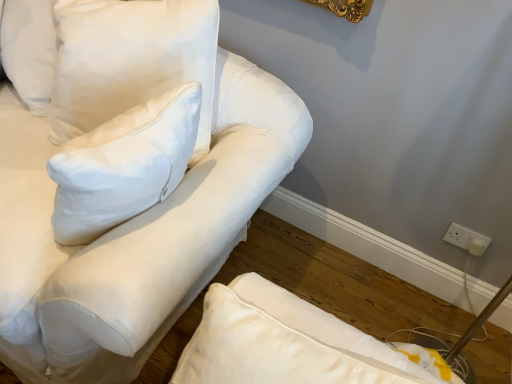
This screenshot has height=384, width=512. What are the coordinates of `white plastic socket at lower right` in the screenshot? It's located at (467, 239).

What is the approximate height of white cotton sofa at upper left?

The height of white cotton sofa at upper left is 32.60 inches.

This screenshot has width=512, height=384. I want to click on white plastic socket at lower right, so click(467, 239).

Would you say white plastic socket at lower right is to the left or to the right of white cotton sofa at upper left in the picture?

Based on their positions, white plastic socket at lower right is located to the right of white cotton sofa at upper left.

Is white plastic socket at lower right not close to white cotton sofa at upper left?

Yes, white plastic socket at lower right and white cotton sofa at upper left are located far from each other.

From the image's perspective, is white plastic socket at lower right located above or below white cotton sofa at upper left?

white plastic socket at lower right is situated lower than white cotton sofa at upper left in the image.

Is white cotton pillow at upper left, the first pillow positioned from the right, situated inside white plastic socket at lower right or outside?

white cotton pillow at upper left, the first pillow positioned from the right, is outside white plastic socket at lower right.

Based on the photo, can you confirm if white cotton pillow at upper left, the first pillow positioned from the right, is positioned to the left of white plastic socket at lower right?

Indeed, white cotton pillow at upper left, the first pillow positioned from the right, is positioned on the left side of white plastic socket at lower right.

From a real-world perspective, between white cotton pillow at upper left, the first pillow positioned from the right, and white plastic socket at lower right, who is vertically lower?

white plastic socket at lower right is physically lower.

Considering the sizes of objects white cotton pillow at upper left, the first pillow when ordered from left to right, and white plastic socket at lower right in the image provided, who is smaller, white cotton pillow at upper left, the first pillow when ordered from left to right, or white plastic socket at lower right?

white plastic socket at lower right is smaller.

From the picture: Are white cotton pillow at upper left, the first pillow when ordered from left to right, and white plastic socket at lower right beside each other?

No, white cotton pillow at upper left, the first pillow when ordered from left to right, is not next to white plastic socket at lower right.

From a real-world perspective, between white cotton pillow at upper left, the first pillow when ordered from left to right, and white plastic socket at lower right, who is vertically higher?

white cotton pillow at upper left, the first pillow when ordered from left to right, from a real-world perspective.

Is white plastic socket at lower right outside of white cotton pillow at upper left, the first pillow positioned from the right?

Indeed, white plastic socket at lower right is completely outside white cotton pillow at upper left, the first pillow positioned from the right.

Is white plastic socket at lower right bigger or smaller than white cotton pillow at upper left, the first pillow positioned from the right?

In the image, white plastic socket at lower right appears to be smaller than white cotton pillow at upper left, the first pillow positioned from the right.

From the image's perspective, would you say white plastic socket at lower right is positioned over white cotton pillow at upper left, the 2th pillow from the left?

Incorrect, from the image's perspective, white plastic socket at lower right is lower than white cotton pillow at upper left, the 2th pillow from the left.

Does white plastic socket at lower right have a greater width compared to white cotton pillow at upper left, the 2th pillow from the left?

No.

From a real-world perspective, is white cotton sofa at upper left beneath white plastic socket at lower right?

No, from a real-world perspective, white cotton sofa at upper left is not beneath white plastic socket at lower right.

Considering their positions, is white cotton sofa at upper left located in front of or behind white plastic socket at lower right?

white cotton sofa at upper left is in front of white plastic socket at lower right.

Looking at this image, from the image's perspective, does white cotton sofa at upper left appear lower than white plastic socket at lower right?

No, from the image's perspective, white cotton sofa at upper left is not beneath white plastic socket at lower right.

Can you confirm if white cotton sofa at upper left is bigger than white plastic socket at lower right?

Indeed, white cotton sofa at upper left has a larger size compared to white plastic socket at lower right.

Considering the relative sizes of white plastic socket at lower right and white cotton pillow at upper left, the first pillow when ordered from left to right, in the image provided, is white plastic socket at lower right wider than white cotton pillow at upper left, the first pillow when ordered from left to right,?

No, white plastic socket at lower right is not wider than white cotton pillow at upper left, the first pillow when ordered from left to right.

From a real-world perspective, between white plastic socket at lower right and white cotton pillow at upper left, the first pillow when ordered from left to right, who is vertically higher?

From a 3D spatial view, white cotton pillow at upper left, the first pillow when ordered from left to right, is above.

In the scene shown: Is white plastic socket at lower right taller than white cotton pillow at upper left, which appears as the 2th pillow when viewed from the right?

No, white plastic socket at lower right is not taller than white cotton pillow at upper left, which appears as the 2th pillow when viewed from the right.

Which object is positioned more to the right, white plastic socket at lower right or white cotton pillow at upper left, the first pillow when ordered from left to right?

white plastic socket at lower right is more to the right.

Are white cotton sofa at upper left and white cotton pillow at upper left, the first pillow positioned from the right, making contact?

No, white cotton sofa at upper left is not touching white cotton pillow at upper left, the first pillow positioned from the right.

From the image's perspective, is white cotton sofa at upper left above white cotton pillow at upper left, the first pillow positioned from the right?

No, from the image's perspective, white cotton sofa at upper left is not above white cotton pillow at upper left, the first pillow positioned from the right.

Is white cotton sofa at upper left positioned with its back to white cotton pillow at upper left, the 2th pillow from the left?

Yes, white cotton sofa at upper left's orientation is away from white cotton pillow at upper left, the 2th pillow from the left.

Who is bigger, white cotton sofa at upper left or white cotton pillow at upper left, the first pillow positioned from the right?

white cotton sofa at upper left.

You are a GUI agent. You are given a task and a screenshot of the screen. Output one action in this format:
    pyautogui.click(x=<x>, y=<y>)
    Task: Click on the electric outlet below the white cotton sofa at upper left (from a real-world perspective)
    The height and width of the screenshot is (384, 512).
    Given the screenshot: What is the action you would take?
    pyautogui.click(x=467, y=239)

Locate an element on the screen. Image resolution: width=512 pixels, height=384 pixels. electric outlet on the right of white cotton pillow at upper left, the first pillow positioned from the right is located at coordinates (467, 239).

Looking at this image, which object lies further to the anchor point white plastic socket at lower right, white cotton pillow at upper left, the first pillow when ordered from left to right, or white cotton sofa at upper left?

white cotton pillow at upper left, the first pillow when ordered from left to right.

Which object lies nearer to the anchor point white cotton sofa at upper left, white cotton pillow at upper left, the 2th pillow from the left, or white plastic socket at lower right?

The object closer to white cotton sofa at upper left is white cotton pillow at upper left, the 2th pillow from the left.

From the image, which object appears to be nearer to white cotton sofa at upper left, white cotton pillow at upper left, the first pillow when ordered from left to right, or white cotton pillow at upper left, the 2th pillow from the left?

The object closer to white cotton sofa at upper left is white cotton pillow at upper left, the 2th pillow from the left.

Estimate the real-world distances between objects in this image. Which object is closer to white cotton pillow at upper left, the first pillow when ordered from left to right, white cotton sofa at upper left or white cotton pillow at upper left, the 2th pillow from the left?

white cotton pillow at upper left, the 2th pillow from the left, lies closer to white cotton pillow at upper left, the first pillow when ordered from left to right, than the other object.

Estimate the real-world distances between objects in this image. Which object is closer to white plastic socket at lower right, white cotton pillow at upper left, the 2th pillow from the left, or white cotton pillow at upper left, which appears as the 2th pillow when viewed from the right?

white cotton pillow at upper left, the 2th pillow from the left, is positioned closer to the anchor white plastic socket at lower right.

Considering their positions, is white plastic socket at lower right positioned further to white cotton pillow at upper left, the first pillow when ordered from left to right, than white cotton pillow at upper left, the 2th pillow from the left?

Among the two, white plastic socket at lower right is located further to white cotton pillow at upper left, the first pillow when ordered from left to right.

Looking at this image, from the image, which object appears to be farther from white cotton sofa at upper left, white plastic socket at lower right or white cotton pillow at upper left, the 2th pillow from the left?

The object further to white cotton sofa at upper left is white plastic socket at lower right.

When comparing their distances from white cotton sofa at upper left, does white cotton pillow at upper left, the 2th pillow from the left, or white cotton pillow at upper left, the first pillow when ordered from left to right, seem further?

white cotton pillow at upper left, the first pillow when ordered from left to right, lies further to white cotton sofa at upper left than the other object.

Find the location of a particular element. pillow between white cotton pillow at upper left, the first pillow when ordered from left to right, and white plastic socket at lower right from left to right is located at coordinates (130, 60).

I want to click on pillow located between white cotton sofa at upper left and white plastic socket at lower right in the left-right direction, so click(130, 60).

You are a GUI agent. You are given a task and a screenshot of the screen. Output one action in this format:
    pyautogui.click(x=<x>, y=<y>)
    Task: Click on the pillow located between white cotton sofa at upper left and white cotton pillow at upper left, which appears as the 2th pillow when viewed from the right, in the depth direction
    
    Given the screenshot: What is the action you would take?
    pyautogui.click(x=130, y=60)

Where is `furniture located between white cotton pillow at upper left, the first pillow when ordered from left to right, and white plastic socket at lower right in the left-right direction`? The height and width of the screenshot is (384, 512). furniture located between white cotton pillow at upper left, the first pillow when ordered from left to right, and white plastic socket at lower right in the left-right direction is located at coordinates (133, 236).